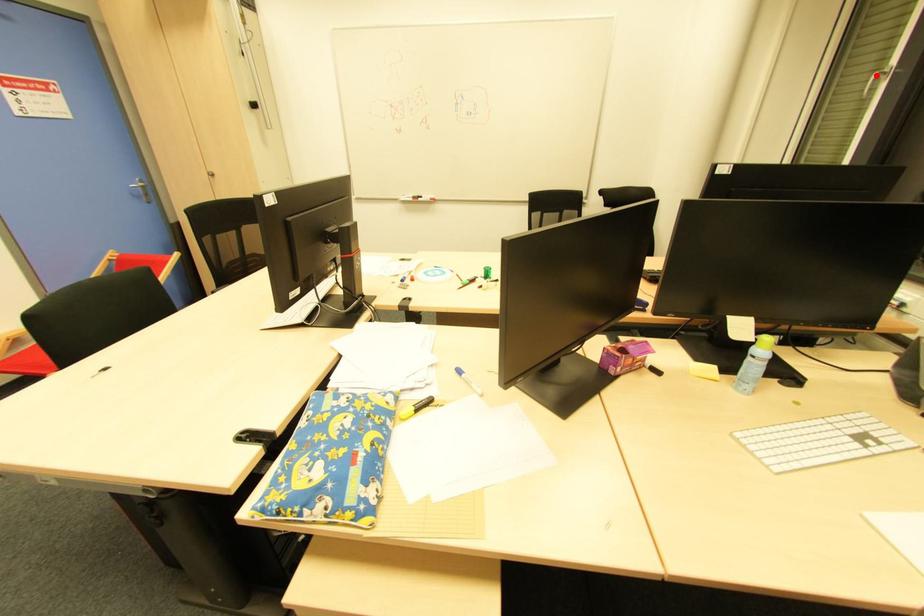
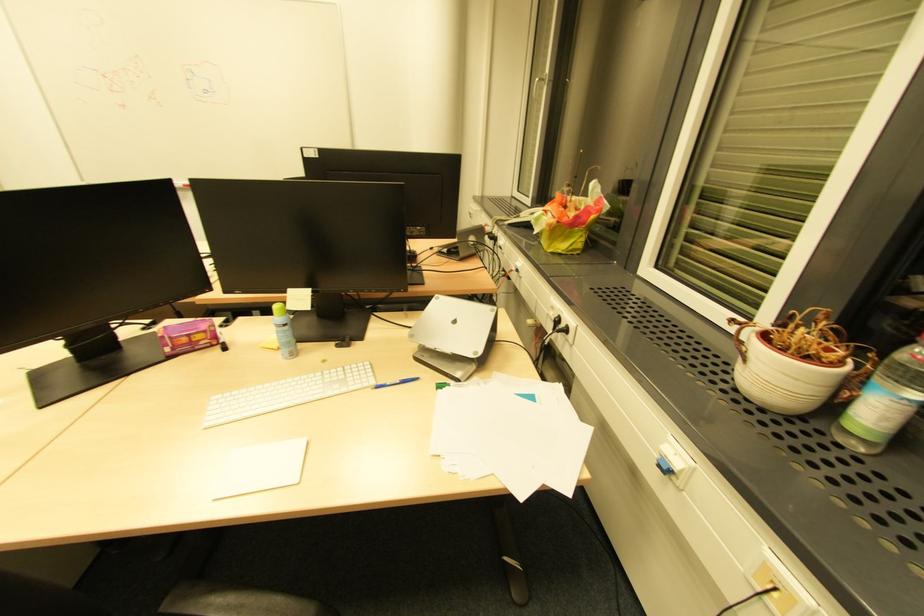
The point at the highlighted location is marked in the first image. Where is the corresponding point in the second image?

(536, 81)